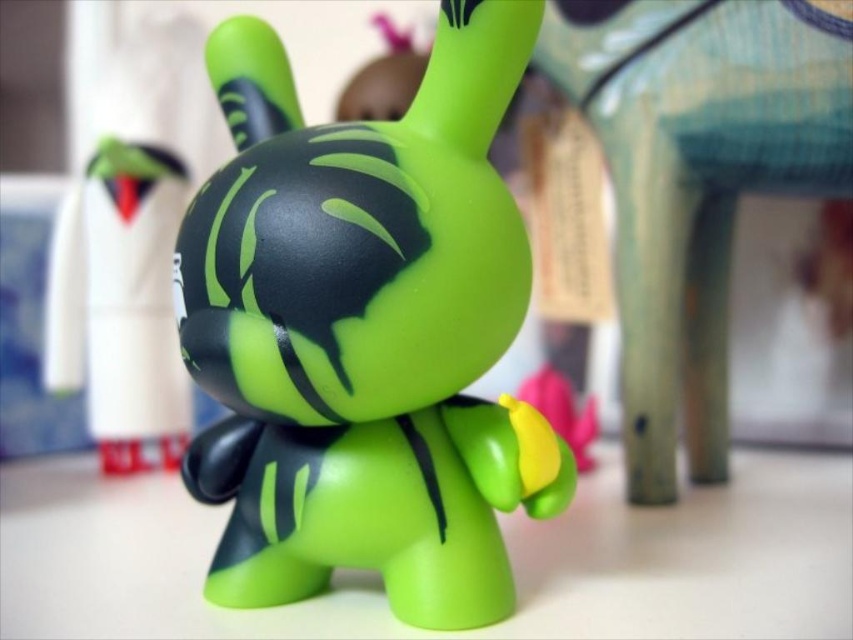
Which of these two, green matte toy at center or green matte toy at upper left, stands taller?

With more height is green matte toy at center.

Does green matte toy at center have a greater height compared to green matte toy at upper left?

Indeed, green matte toy at center has a greater height compared to green matte toy at upper left.

Is point (732, 10) more distant than point (51, 280)?

That is False.

What are the coordinates of `green matte toy at center` in the screenshot? It's located at (695, 182).

Between matte green plastic toy at center and green matte table at center, which one is positioned higher?

matte green plastic toy at center

This screenshot has height=640, width=853. Describe the element at coordinates (364, 332) in the screenshot. I see `matte green plastic toy at center` at that location.

Locate an element on the screen. matte green plastic toy at center is located at coordinates (364, 332).

Which is behind, point (816, 486) or point (541, 67)?

Point (541, 67)

Does green matte table at center appear over green matte toy at center?

No, green matte table at center is not above green matte toy at center.

Who is more forward, (x=709, y=509) or (x=606, y=72)?

Point (x=709, y=509) is in front.

Find the location of `green matte table at center`. green matte table at center is located at coordinates coord(503,540).